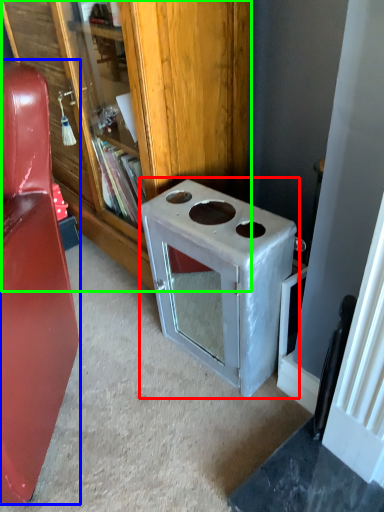
Question: Which object is positioned closest to appliance (highlighted by a red box)? Select from furniture (highlighted by a blue box) and bookcase (highlighted by a green box).

Choices:
 (A) furniture
 (B) bookcase

Answer: (B)